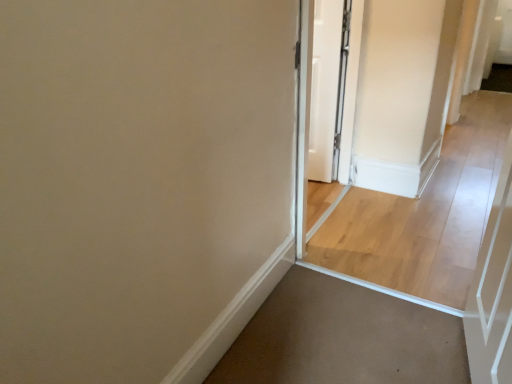
The width and height of the screenshot is (512, 384). What do you see at coordinates (345, 115) in the screenshot?
I see `white glossy screen door at center` at bounding box center [345, 115].

The image size is (512, 384). Describe the element at coordinates (328, 87) in the screenshot. I see `white glossy door at center` at that location.

The width and height of the screenshot is (512, 384). What are the coordinates of `white glossy door at center` in the screenshot? It's located at (328, 87).

Locate an element on the screen. This screenshot has height=384, width=512. light wood floor at center is located at coordinates (425, 214).

Is point (356, 77) positioned before point (393, 274)?

No, it is behind (393, 274).

Which is correct: white glossy screen door at center is inside light wood floor at center, or outside of it?

The correct answer is: outside.

From a real-world perspective, is white glossy screen door at center on light wood floor at center?

Yes, from a real-world perspective, white glossy screen door at center is above light wood floor at center.

Can you tell me how much light wood floor at center and white glossy screen door at center differ in facing direction?

There is a 88.2-degree angle between the facing directions of light wood floor at center and white glossy screen door at center.

Does light wood floor at center lie in front of white glossy screen door at center?

No, it is behind white glossy screen door at center.

Are light wood floor at center and white glossy screen door at center making contact?

light wood floor at center and white glossy screen door at center are clearly separated.

Considering the sizes of objects light wood floor at center and white glossy screen door at center in the image provided, who is shorter, light wood floor at center or white glossy screen door at center?

With less height is light wood floor at center.

Which is in front, point (316, 224) or point (312, 158)?

The point (316, 224) is in front.

In terms of size, does white glossy screen door at center appear bigger or smaller than white glossy door at center?

Considering their sizes, white glossy screen door at center takes up more space than white glossy door at center.

Is white glossy screen door at center not close to white glossy door at center?

No, there isn't a large distance between white glossy screen door at center and white glossy door at center.

Visually, is white glossy door at center positioned to the left or to the right of light wood floor at center?

Clearly, white glossy door at center is on the left of light wood floor at center in the image.

From the picture: From a real-world perspective, is white glossy door at center on light wood floor at center?

Yes.

Which is in front, white glossy door at center or light wood floor at center?

Positioned in front is light wood floor at center.

From the image's perspective, relative to light wood floor at center, is white glossy door at center above or below?

From the image's perspective, white glossy door at center appears below light wood floor at center.

From the image's perspective, which is below, white glossy door at center or white glossy screen door at center?

white glossy screen door at center.

Can you tell me how much white glossy door at center and white glossy screen door at center differ in facing direction?

The facing directions of white glossy door at center and white glossy screen door at center are 80 degrees apart.

Is white glossy door at center turned away from white glossy screen door at center?

That's not correct — white glossy door at center is not looking away from white glossy screen door at center.

At what (x,y) coordinates should I click in order to perform the action: click on screen door directly beneath the white glossy door at center (from a real-world perspective). Please return your answer as a coordinate pair (x, y). Looking at the image, I should click on (345, 115).

Which object is positioned more to the right, light wood floor at center or white glossy door at center?

Positioned to the right is light wood floor at center.

Between light wood floor at center and white glossy door at center, which one has smaller width?

white glossy door at center is thinner.

You are a GUI agent. You are given a task and a screenshot of the screen. Output one action in this format:
    pyautogui.click(x=<x>, y=<y>)
    Task: Click on the screen door on the left of light wood floor at center
    The image size is (512, 384).
    Given the screenshot: What is the action you would take?
    pyautogui.click(x=345, y=115)

Where is `path above the white glossy screen door at center (from the image's perspective)`? path above the white glossy screen door at center (from the image's perspective) is located at coordinates (425, 214).

Considering their positions, is light wood floor at center positioned further to white glossy door at center than white glossy screen door at center?

light wood floor at center lies further to white glossy door at center than the other object.

Estimate the real-world distances between objects in this image. Which object is further from white glossy screen door at center, white glossy door at center or light wood floor at center?

light wood floor at center is further to white glossy screen door at center.

Which object lies nearer to the anchor point light wood floor at center, white glossy door at center or white glossy screen door at center?

white glossy screen door at center lies closer to light wood floor at center than the other object.

From the image, which object appears to be farther from white glossy door at center, white glossy screen door at center or light wood floor at center?

Based on the image, light wood floor at center appears to be further to white glossy door at center.

Based on the photo, from the image, which object appears to be farther from white glossy screen door at center, light wood floor at center or white glossy door at center?

light wood floor at center.

From the image, which object appears to be nearer to light wood floor at center, white glossy screen door at center or white glossy door at center?

Among the two, white glossy screen door at center is located nearer to light wood floor at center.

This screenshot has height=384, width=512. Find the location of `door between white glossy screen door at center and light wood floor at center in the horizontal direction`. door between white glossy screen door at center and light wood floor at center in the horizontal direction is located at coordinates (328, 87).